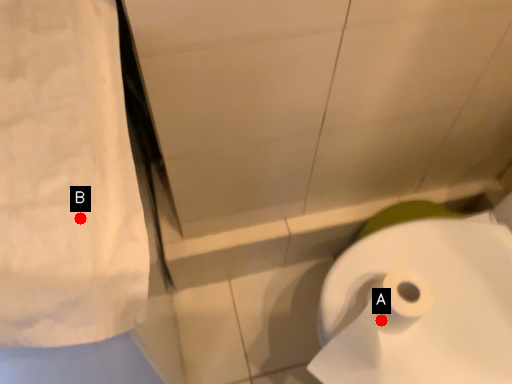
Question: Two points are circled on the image, labeled by A and B beside each circle. Among these points, which one is nearest to the camera?

Choices:
 (A) A is closer
 (B) B is closer

Answer: (B)